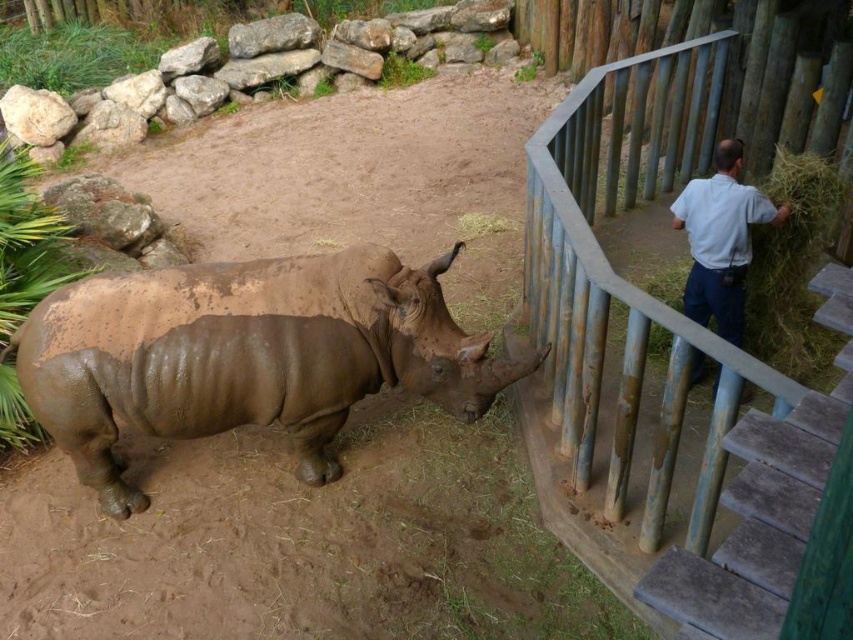
Who is positioned more to the left, muddy brown rhinoceros at lower left or white shirt at upper right?

Positioned to the left is muddy brown rhinoceros at lower left.

Find the location of a particular element. muddy brown rhinoceros at lower left is located at coordinates (245, 355).

Where is `muddy brown rhinoceros at lower left`? muddy brown rhinoceros at lower left is located at coordinates (245, 355).

Identify the location of muddy brown rhinoceros at lower left. (245, 355).

Does muddy brown rhinoceros at lower left have a lesser height compared to rustic wooden railing at right?

Correct, muddy brown rhinoceros at lower left is not as tall as rustic wooden railing at right.

Can you confirm if muddy brown rhinoceros at lower left is thinner than rustic wooden railing at right?

No, muddy brown rhinoceros at lower left is not thinner than rustic wooden railing at right.

Is point (361, 304) positioned in front of point (704, 522)?

No, it is not.

You are a GUI agent. You are given a task and a screenshot of the screen. Output one action in this format:
    pyautogui.click(x=<x>, y=<y>)
    Task: Click on the muddy brown rhinoceros at lower left
    Image resolution: width=853 pixels, height=640 pixels.
    Given the screenshot: What is the action you would take?
    pos(245,355)

Who is taller, rustic wooden railing at right or rusty metal stairs at right?

rustic wooden railing at right is taller.

Does rustic wooden railing at right have a smaller size compared to rusty metal stairs at right?

No, rustic wooden railing at right is not smaller than rusty metal stairs at right.

Image resolution: width=853 pixels, height=640 pixels. In order to click on rustic wooden railing at right in this screenshot , I will do `click(631, 340)`.

Locate an element on the screen. rustic wooden railing at right is located at coordinates (631, 340).